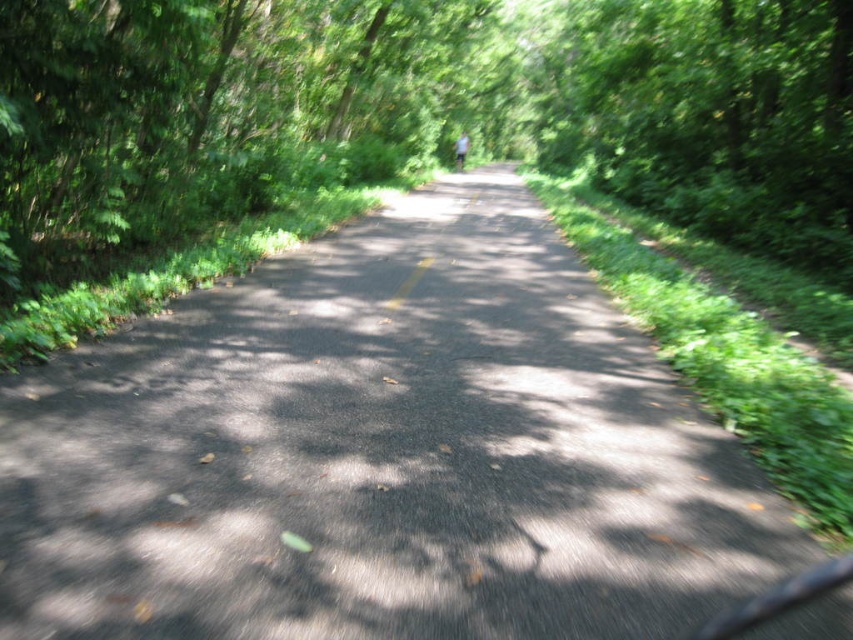
Looking at this image, you are a pedestrian standing on the black asphalt road at center. You see a white cotton shirt at center in front of you. Which object is bigger in size?

The black asphalt road at center is larger in size compared to the white cotton shirt at center.

You are standing on the black asphalt road at center and want to pick up the white cotton shirt at center. Which direction should you move to reach it?

The black asphalt road at center is closer to the viewer than the white cotton shirt at center, so you should move forward away from the road to reach the white cotton shirt at center.

You are a pedestrian standing on the black asphalt road at center. You see a white cotton shirt at center. Which object is wider?

The black asphalt road at center is wider than the white cotton shirt at center.